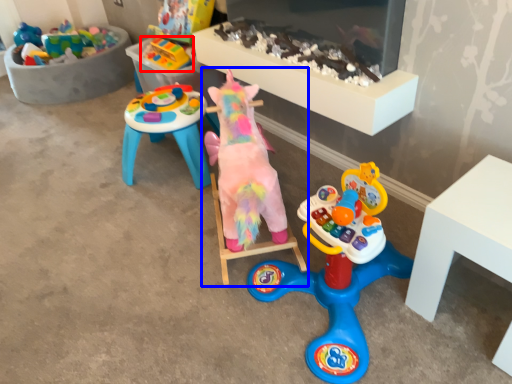
Question: Which point is closer to the camera, toy (highlighted by a red box) or toy (highlighted by a blue box)?

Choices:
 (A) toy
 (B) toy

Answer: (B)